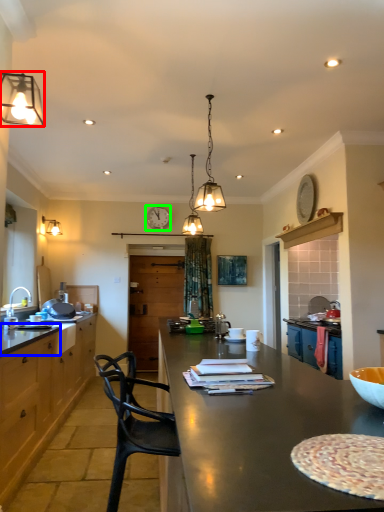
Question: Considering the real-world distances, which object is closest to lamp (highlighted by a red box)? counter top (highlighted by a blue box) or clock (highlighted by a green box).

Choices:
 (A) counter top
 (B) clock

Answer: (A)